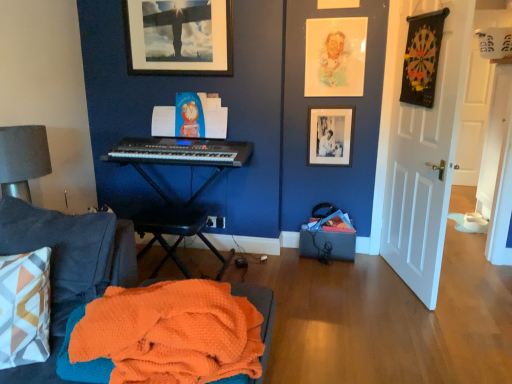
Question: Considering the relative positions of orange waffle knit blanket at lower left and white matte door at right in the image provided, is orange waffle knit blanket at lower left to the left of white matte door at right from the viewer's perspective?

Choices:
 (A) no
 (B) yes

Answer: (B)

Question: Considering the relative sizes of orange waffle knit blanket at lower left and white matte door at right in the image provided, is orange waffle knit blanket at lower left shorter than white matte door at right?

Choices:
 (A) yes
 (B) no

Answer: (A)

Question: Does orange waffle knit blanket at lower left have a lesser width compared to white matte door at right?

Choices:
 (A) yes
 (B) no

Answer: (B)

Question: Is orange waffle knit blanket at lower left positioned behind white matte door at right?

Choices:
 (A) yes
 (B) no

Answer: (B)

Question: Is orange waffle knit blanket at lower left facing away from white matte door at right?

Choices:
 (A) yes
 (B) no

Answer: (B)

Question: From the image's perspective, is pastel watercolor portrait at upper center located above or below matte black picture frame at upper center, which is the first picture frame from left to right?

Choices:
 (A) below
 (B) above

Answer: (A)

Question: Looking at the image, does pastel watercolor portrait at upper center seem bigger or smaller compared to matte black picture frame at upper center, positioned as the 2th picture frame in bottom-to-top order?

Choices:
 (A) small
 (B) big

Answer: (A)

Question: Is pastel watercolor portrait at upper center in front of or behind matte black picture frame at upper center, which is the first picture frame from top to bottom, in the image?

Choices:
 (A) behind
 (B) front

Answer: (A)

Question: Is pastel watercolor portrait at upper center inside the boundaries of matte black picture frame at upper center, positioned as the 2th picture frame in bottom-to-top order, or outside?

Choices:
 (A) outside
 (B) inside

Answer: (A)

Question: Is point (350, 115) closer or farther from the camera than point (397, 155)?

Choices:
 (A) farther
 (B) closer

Answer: (A)

Question: In terms of width, does black matte picture frame at upper right, the second picture frame viewed from the left, look wider or thinner when compared to white matte door at right?

Choices:
 (A) wide
 (B) thin

Answer: (B)

Question: From a real-world perspective, is black matte picture frame at upper right, the second picture frame viewed from the left, above or below white matte door at right?

Choices:
 (A) below
 (B) above

Answer: (A)

Question: Visually, is black matte picture frame at upper right, the first picture frame when ordered from bottom to top, positioned to the left or to the right of white matte door at right?

Choices:
 (A) left
 (B) right

Answer: (A)

Question: From the image's perspective, is black plastic music stool at center positioned above or below white matte door at right?

Choices:
 (A) above
 (B) below

Answer: (B)

Question: Do you think black plastic music stool at center is within white matte door at right, or outside of it?

Choices:
 (A) outside
 (B) inside

Answer: (A)